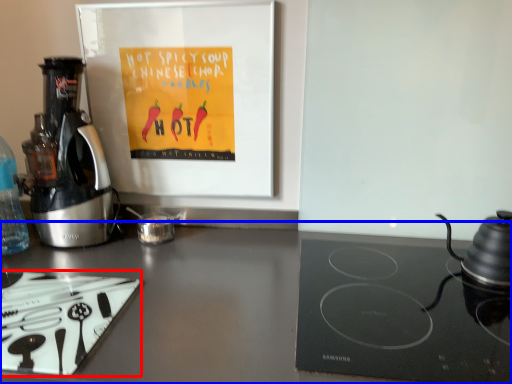
Question: Which object is further to the camera taking this photo, kitchen appliance (highlighted by a red box) or counter top (highlighted by a blue box)?

Choices:
 (A) kitchen appliance
 (B) counter top

Answer: (A)